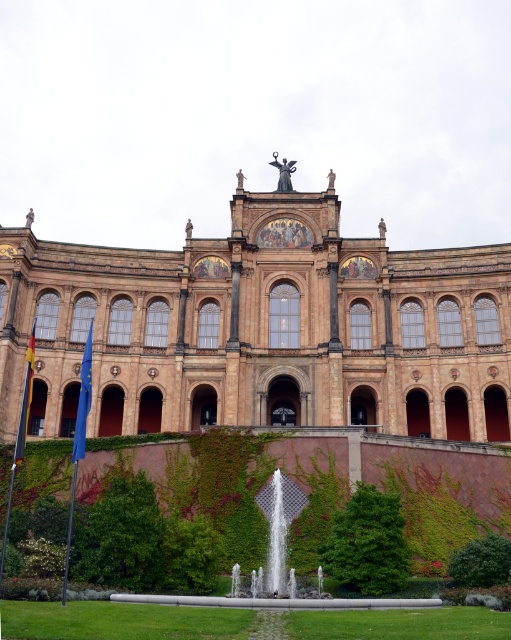
Who is lower down, green leafy hedge at lower left or green leafy hedge at lower right?

green leafy hedge at lower right is lower down.

Is green leafy hedge at lower left below green leafy hedge at lower right?

Incorrect, green leafy hedge at lower left is not positioned below green leafy hedge at lower right.

Does point (122, 502) lie behind point (450, 573)?

No.

Find the location of a particular element. The width and height of the screenshot is (511, 640). green leafy hedge at lower left is located at coordinates (122, 536).

Can you confirm if green leafy hedge at lower left is positioned to the left of clear glass water at center?

Indeed, green leafy hedge at lower left is positioned on the left side of clear glass water at center.

Is point (103, 561) positioned behind point (271, 589)?

No.

Image resolution: width=511 pixels, height=640 pixels. I want to click on green leafy hedge at lower left, so click(x=122, y=536).

Can you confirm if brown stone palace at center is positioned above clear glass water at center?

Correct, brown stone palace at center is located above clear glass water at center.

Between brown stone palace at center and clear glass water at center, which one is positioned lower?

clear glass water at center is lower down.

Does point (481, 296) come behind point (267, 488)?

Yes, point (481, 296) is farther from viewer.

This screenshot has width=511, height=640. I want to click on brown stone palace at center, so click(x=261, y=326).